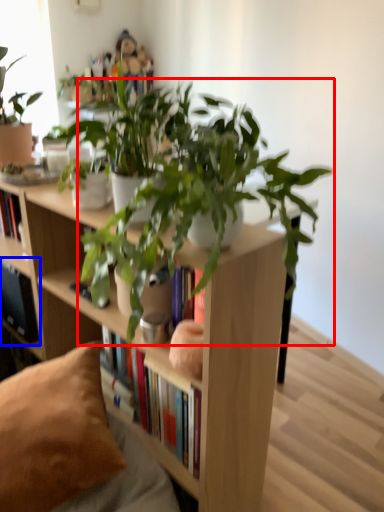
Question: Among these objects, which one is farthest to the camera, houseplant (highlighted by a red box) or shelf (highlighted by a blue box)?

Choices:
 (A) houseplant
 (B) shelf

Answer: (B)